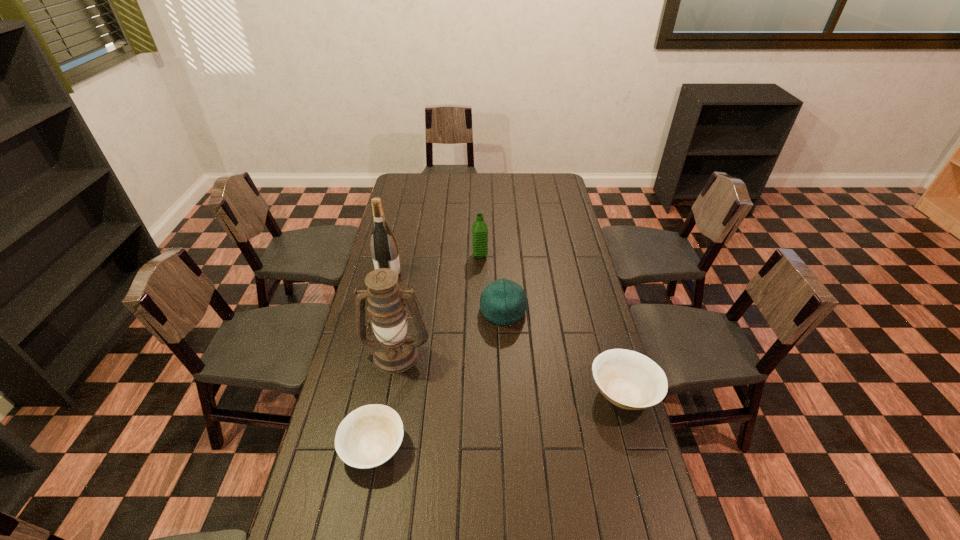
Find the location of `the shortest object`. the shortest object is located at coordinates [x=369, y=436].

Image resolution: width=960 pixels, height=540 pixels. What are the coordinates of `the left bowl` in the screenshot? It's located at (369, 436).

What are the coordinates of `the rightmost object` in the screenshot? It's located at (630, 380).

Locate an element on the screen. The width and height of the screenshot is (960, 540). the second shortest object is located at coordinates (630, 380).

This screenshot has height=540, width=960. What are the coordinates of `the second farthest object` in the screenshot? It's located at point(384,249).

Locate an element on the screen. This screenshot has height=540, width=960. the farthest object is located at coordinates (479, 229).

Locate an element on the screen. This screenshot has width=960, height=540. water bottle is located at coordinates (479, 229).

The height and width of the screenshot is (540, 960). Identify the location of beanie. (503, 302).

You are a GUI agent. You are given a task and a screenshot of the screen. Output one action in this format:
    pyautogui.click(x=<x>, y=<y>)
    Task: Click on the third farthest object
    The width and height of the screenshot is (960, 540).
    Given the screenshot: What is the action you would take?
    pyautogui.click(x=503, y=302)

Image resolution: width=960 pixels, height=540 pixels. What are the coordinates of `oil lamp` in the screenshot? It's located at pos(395,351).